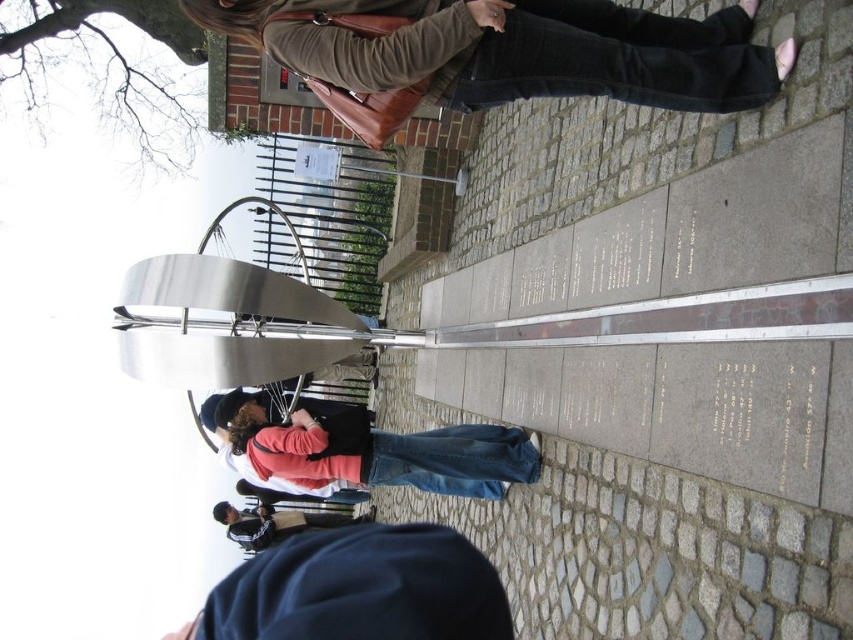
Question: Which point is closer to the camera taking this photo?

Choices:
 (A) (299, 426)
 (B) (281, 532)
 (C) (436, 84)

Answer: (C)

Question: Which of these objects is positioned closest to the black leather skateboard at lower center?

Choices:
 (A) brown leather jacket at upper center
 (B) denim pants at lower center

Answer: (B)

Question: Considering the relative positions of denim pants at lower center and black leather skateboard at lower center in the image provided, where is denim pants at lower center located with respect to black leather skateboard at lower center?

Choices:
 (A) above
 (B) below

Answer: (A)

Question: Does denim pants at lower center come in front of black leather skateboard at lower center?

Choices:
 (A) yes
 (B) no

Answer: (A)

Question: Does denim pants at lower center have a larger size compared to black leather skateboard at lower center?

Choices:
 (A) yes
 (B) no

Answer: (B)

Question: Which object is the farthest from the denim pants at lower center?

Choices:
 (A) black leather skateboard at lower center
 (B) brown leather jacket at upper center

Answer: (A)